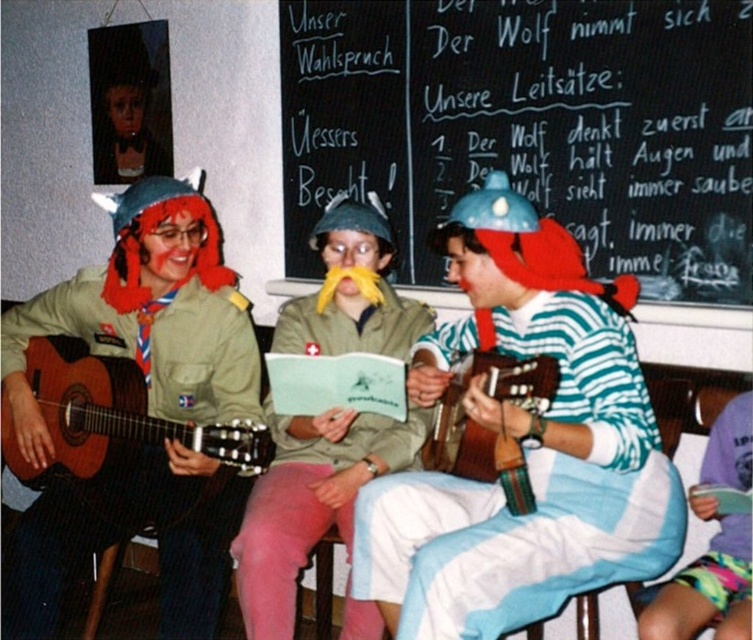
Question: Is yellow felt mustache at center positioned behind wooden acoustic guitar at center?

Choices:
 (A) no
 (B) yes

Answer: (B)

Question: Estimate the real-world distances between objects in this image. Which object is farther from the striped cotton shirt at center?

Choices:
 (A) black chalkboard at upper center
 (B) wooden acoustic guitar at center
 (C) wooden acoustic guitar at left
 (D) blue fabric pillow at lower right

Answer: (C)

Question: Which object is farther from the camera taking this photo?

Choices:
 (A) green uniform at left
 (B) blue fabric pillow at lower right

Answer: (A)

Question: Which point is farther from the camera taking this photo?

Choices:
 (A) (723, 611)
 (B) (383, 280)
 (C) (294, 115)
 (D) (17, 556)

Answer: (C)

Question: From the image, what is the correct spatial relationship of green uniform at left in relation to yellow felt mustache at center?

Choices:
 (A) left
 (B) right

Answer: (A)

Question: Does black chalkboard at upper center have a smaller size compared to green uniform at left?

Choices:
 (A) no
 (B) yes

Answer: (A)